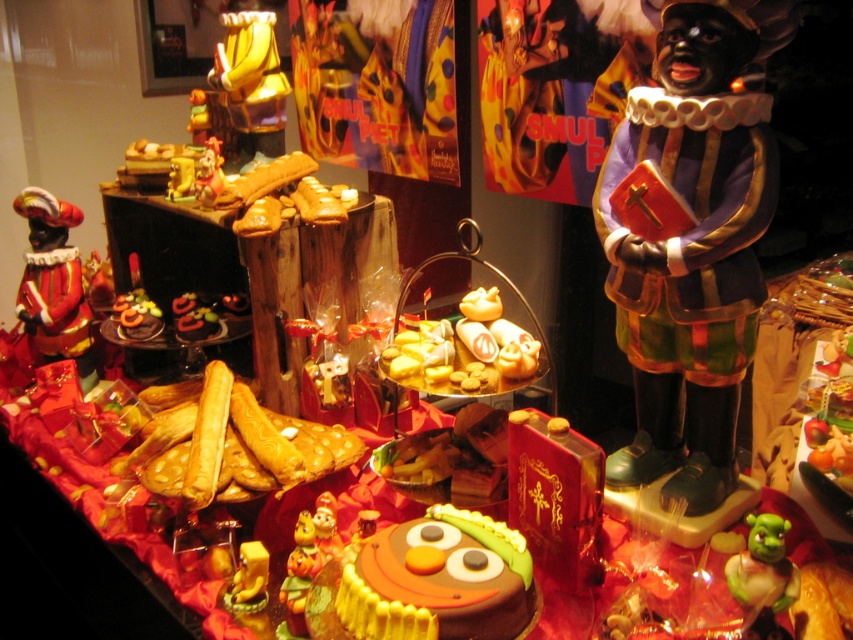
You are standing in front of the festive display table. You need to place a decorative item exactly 6 feet away from where you are standing. Can you use the shiny gold statue at upper center as a reference point to determine the correct placement?

The shiny gold statue at upper center is 5.86 feet away from the viewer. Since 5.86 feet is slightly less than 6 feet, placing the decorative item at the same distance as the shiny gold statue at upper center would be approximately 0.14 feet too close. To achieve the desired 6 feet, you need to move the item about 0.14 feet further away from the current position of the shiny gold statue at upper center.

You are at a festive event and see the green rubber toy at lower right and the matte gold figurine at upper left. Which object is closer to the ground?

The green rubber toy at lower right is positioned under the matte gold figurine at upper left, so it is closer to the ground.

You are standing in front of the table with the red cloth and want to place a small decoration exactly at the point marked as point (250, 80). Based on the scene description, where would this point be located?

The point (250, 80) is located on the shiny gold statue at upper center.